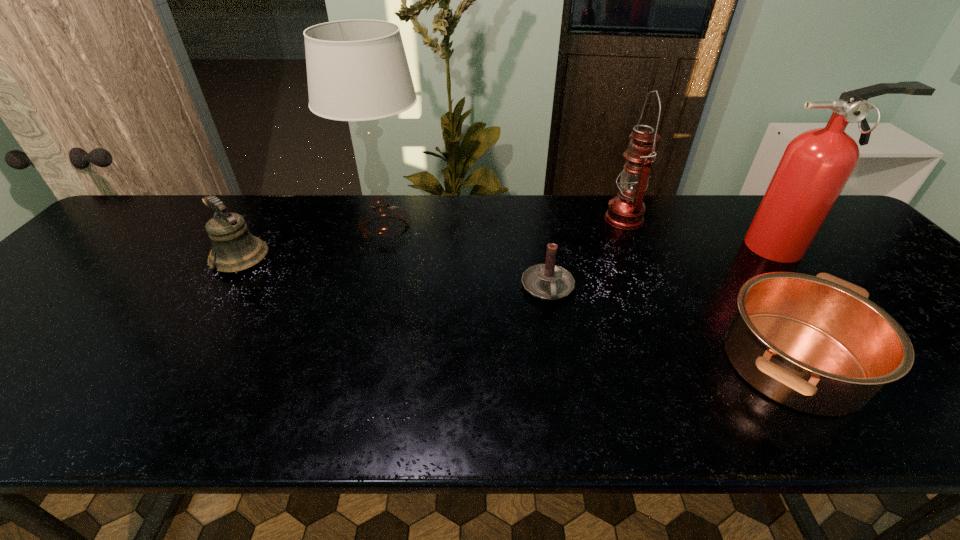
Locate an element on the screen. The image size is (960, 540). vacant space at the far edge of the desktop is located at coordinates (523, 239).

In the image, there is a desktop. Where is `vacant region at the left edge`? vacant region at the left edge is located at coordinates 76,266.

Identify the location of vacant area between the fourth object from right to left and the bell. The width and height of the screenshot is (960, 540). (395, 274).

The image size is (960, 540). Identify the location of vacant region between the third object from left to right and the fire extinguisher. (666, 268).

The image size is (960, 540). Identify the location of empty space that is in between the third object from right to left and the saucepan. (708, 290).

Identify the location of free space between the candle and the tallest object. (467, 258).

Where is `free spot between the fourth object from right to left and the saucepan`? free spot between the fourth object from right to left and the saucepan is located at coordinates (670, 325).

I want to click on free spot between the saucepan and the second object from left to right, so click(x=588, y=295).

I want to click on vacant point located between the second object from left to right and the fire extinguisher, so click(x=585, y=238).

The image size is (960, 540). I want to click on free space between the saucepan and the bell, so click(516, 310).